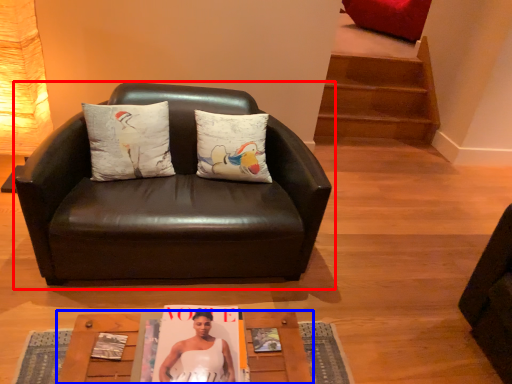
Question: Which of the following is the farthest to the observer, chair (highlighted by a red box) or table (highlighted by a blue box)?

Choices:
 (A) chair
 (B) table

Answer: (A)